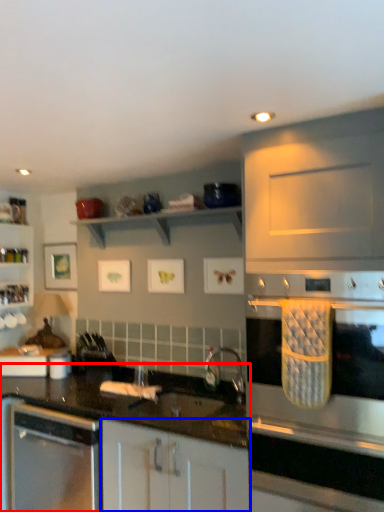
Question: Which object appears farthest to the camera in this image, countertop (highlighted by a red box) or cabinetry (highlighted by a blue box)?

Choices:
 (A) countertop
 (B) cabinetry

Answer: (A)